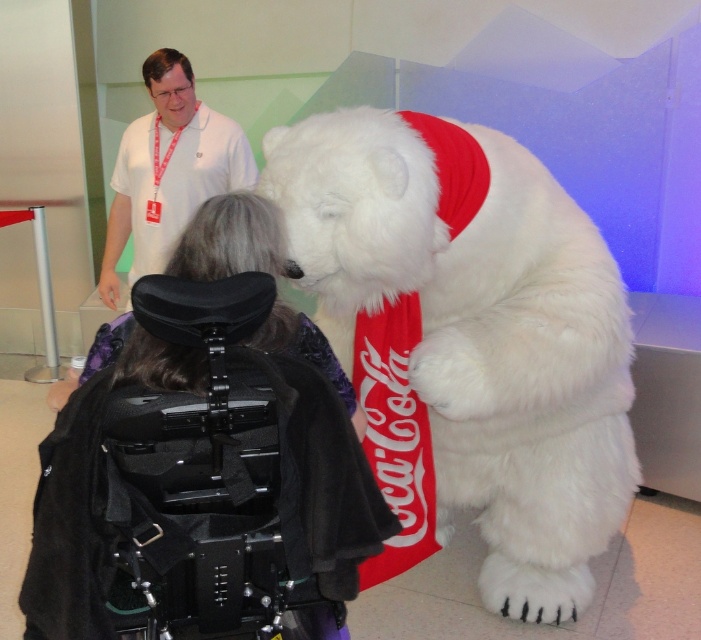
Between point (347, 516) and point (135, 129), which one is positioned in front?

Point (347, 516) is more forward.

Does dark purple fabric at center appear on the right side of white cotton shirt at upper left?

Correct, you'll find dark purple fabric at center to the right of white cotton shirt at upper left.

Is point (325, 452) farther from camera compared to point (163, 141)?

That is False.

The height and width of the screenshot is (640, 701). Find the location of `dark purple fabric at center`. dark purple fabric at center is located at coordinates (205, 456).

Measure the distance between point (599, 456) and camera.

Point (599, 456) and camera are 2.25 meters apart from each other.

I want to click on white fluffy bear at center, so click(x=468, y=340).

What are the coordinates of `white fluffy bear at center` in the screenshot? It's located at (468, 340).

Locate an element on the screen. The height and width of the screenshot is (640, 701). white fluffy bear at center is located at coordinates (468, 340).

Does point (404, 493) come closer to viewer compared to point (147, 412)?

That is False.

Which is below, white fluffy bear at center or dark purple fabric at center?

dark purple fabric at center is below.

Is point (390, 548) more distant than point (196, 342)?

Yes, it is.

Locate an element on the screen. The height and width of the screenshot is (640, 701). white fluffy bear at center is located at coordinates (468, 340).